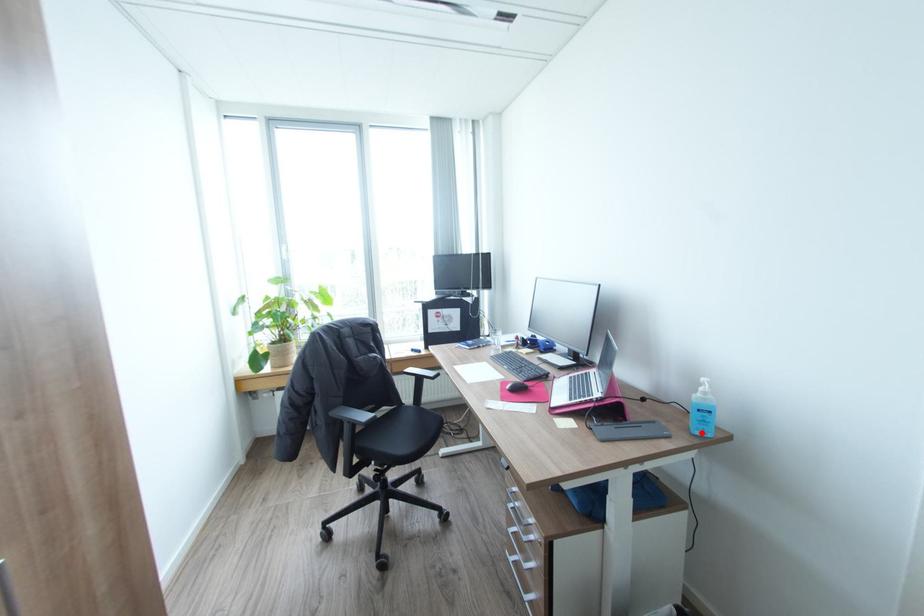
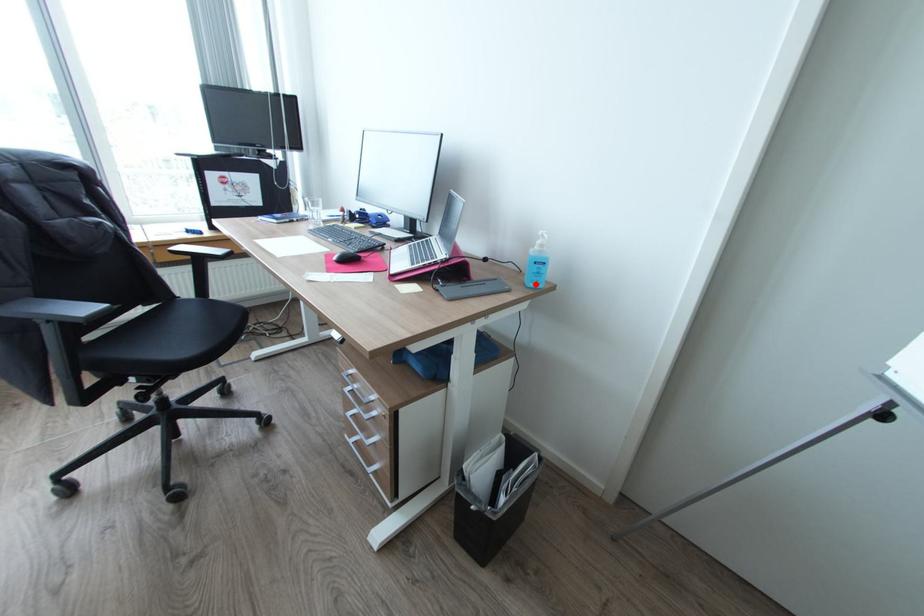
I am providing you with two images of the same scene from different viewpoints. A red point is marked on the first image and another point is marked on the second image. Are the points marked in image1 and image2 representing the same 3D position?

Yes